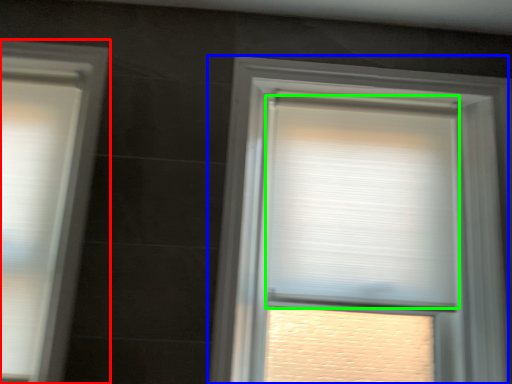
Question: Which object is positioned closest to window (highlighted by a red box)? Select from window (highlighted by a blue box) and window blind (highlighted by a green box).

Choices:
 (A) window
 (B) window blind

Answer: (A)